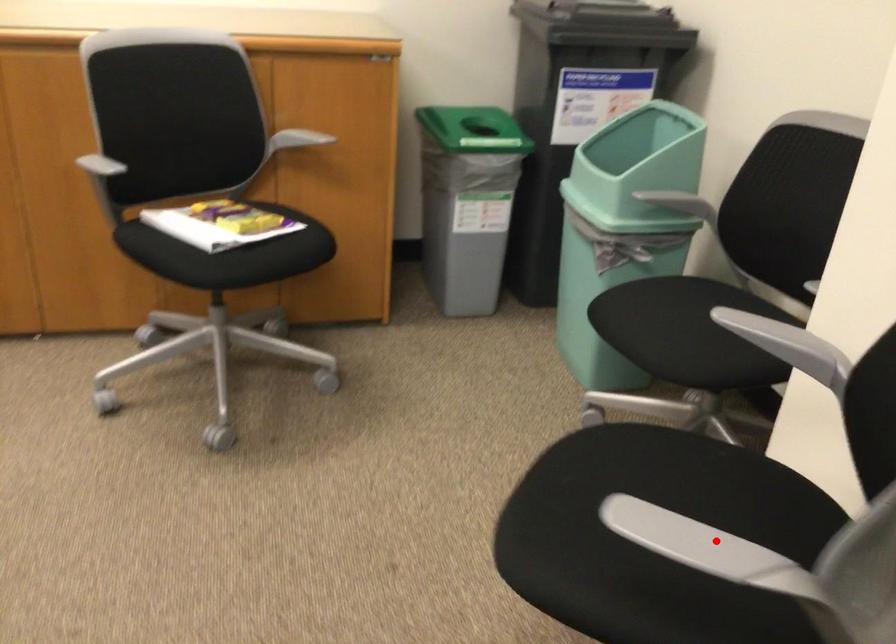
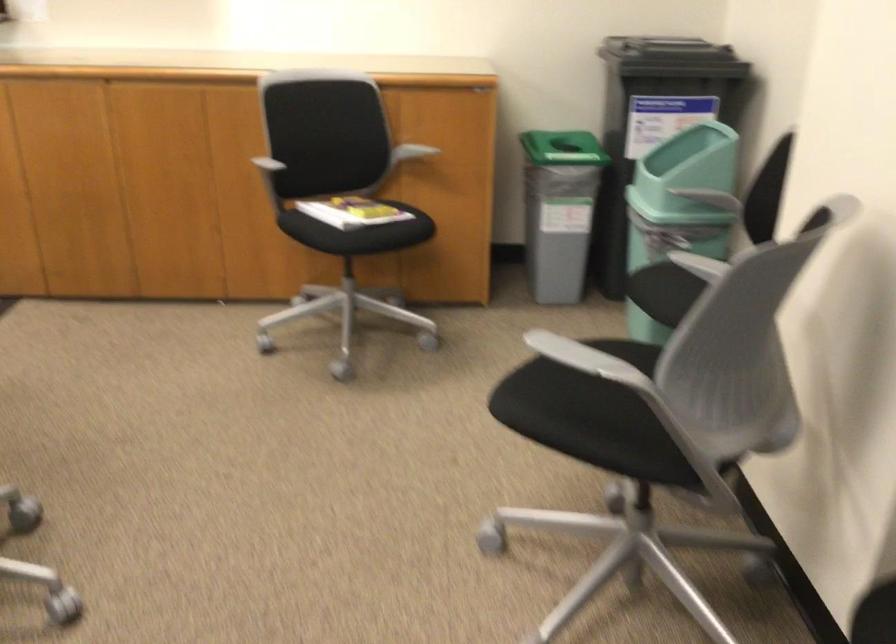
Locate, in the second image, the point that corresponds to the highlighted location in the first image.

(583, 357)